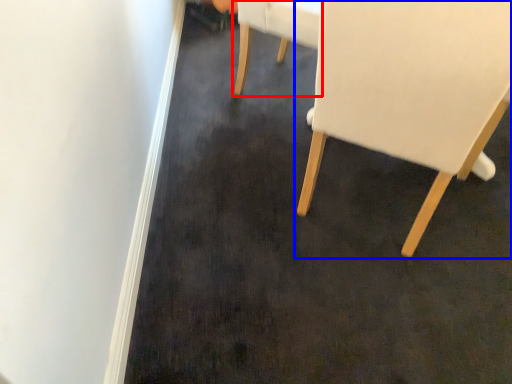
Question: Which object appears closest to the camera in this image, chair (highlighted by a red box) or chair (highlighted by a blue box)?

Choices:
 (A) chair
 (B) chair

Answer: (B)